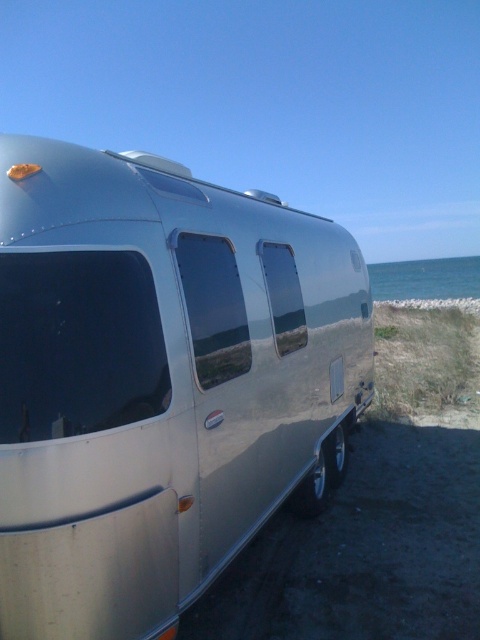
Question: Which of the following is the farthest from the observer?

Choices:
 (A) (462, 259)
 (B) (276, 474)

Answer: (A)

Question: Which object is farther from the camera taking this photo?

Choices:
 (A) silver metallic trailer at center
 (B) blue water at right

Answer: (B)

Question: Is silver metallic trailer at center bigger than blue water at right?

Choices:
 (A) yes
 (B) no

Answer: (B)

Question: Can you confirm if silver metallic trailer at center is wider than blue water at right?

Choices:
 (A) yes
 (B) no

Answer: (B)

Question: Is silver metallic trailer at center to the right of blue water at right from the viewer's perspective?

Choices:
 (A) yes
 (B) no

Answer: (B)